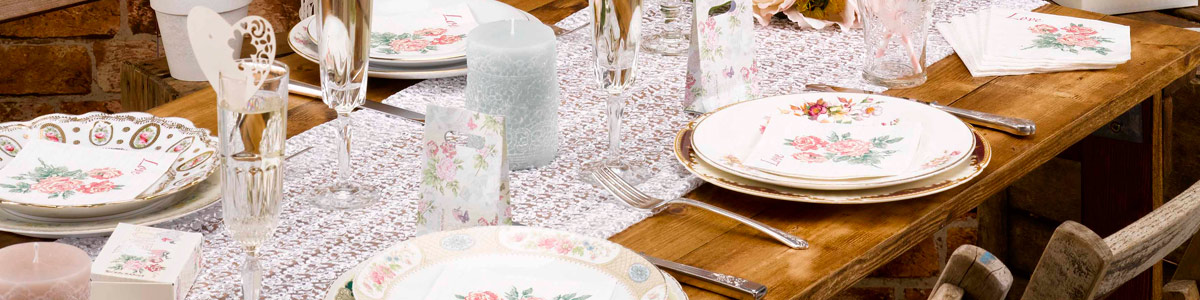
You are a GUI agent. You are given a task and a screenshot of the screen. Output one action in this format:
    pyautogui.click(x=<x>, y=<y>)
    Task: Click on the plates
    The width and height of the screenshot is (1200, 300).
    Given the screenshot: What is the action you would take?
    pyautogui.click(x=450, y=71), pyautogui.click(x=720, y=182), pyautogui.click(x=714, y=153), pyautogui.click(x=584, y=249), pyautogui.click(x=192, y=206), pyautogui.click(x=396, y=57)